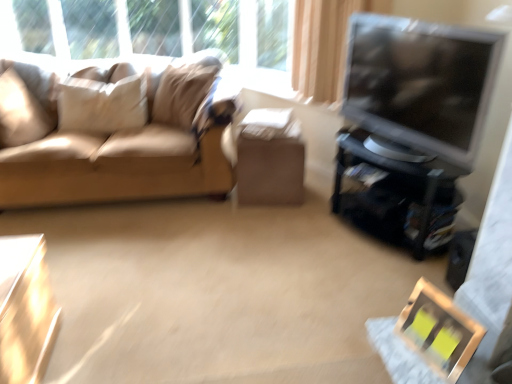
Find the location of `free location to the right of shiny metallic table at lower left, the 2th table viewed from the right`. free location to the right of shiny metallic table at lower left, the 2th table viewed from the right is located at coordinates (111, 347).